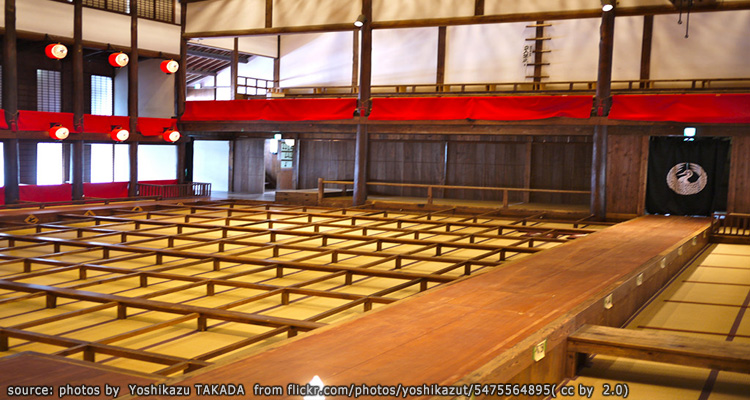
I want to click on wooden table, so click(x=154, y=305).